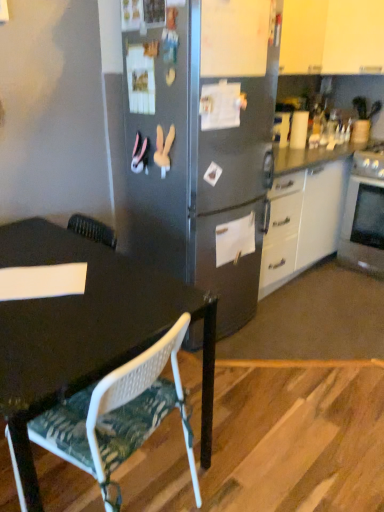
Question: From a real-world perspective, does white mesh chair at lower left sit lower than silver metallic oven at right?

Choices:
 (A) no
 (B) yes

Answer: (A)

Question: Does white mesh chair at lower left have a lesser width compared to silver metallic oven at right?

Choices:
 (A) no
 (B) yes

Answer: (B)

Question: Is white mesh chair at lower left positioned before silver metallic oven at right?

Choices:
 (A) no
 (B) yes

Answer: (B)

Question: Can you confirm if white mesh chair at lower left is smaller than silver metallic oven at right?

Choices:
 (A) yes
 (B) no

Answer: (A)

Question: Can you confirm if white mesh chair at lower left is positioned to the left of silver metallic oven at right?

Choices:
 (A) no
 (B) yes

Answer: (B)

Question: Is white mesh chair at lower left bigger or smaller than white matte cabinet at upper right?

Choices:
 (A) small
 (B) big

Answer: (A)

Question: Is point pos(51,429) positioned closer to the camera than point pos(304,58)?

Choices:
 (A) closer
 (B) farther

Answer: (A)

Question: Considering the positions of white mesh chair at lower left and white matte cabinet at upper right in the image, is white mesh chair at lower left taller or shorter than white matte cabinet at upper right?

Choices:
 (A) short
 (B) tall

Answer: (A)

Question: Is white mesh chair at lower left to the left or to the right of white matte cabinet at upper right in the image?

Choices:
 (A) right
 (B) left

Answer: (B)

Question: Considering the positions of white matte cabinet at upper right and silver metallic oven at right in the image, is white matte cabinet at upper right bigger or smaller than silver metallic oven at right?

Choices:
 (A) small
 (B) big

Answer: (A)

Question: In the image, is white matte cabinet at upper right on the left side or the right side of silver metallic oven at right?

Choices:
 (A) left
 (B) right

Answer: (A)

Question: From a real-world perspective, is white matte cabinet at upper right positioned above or below silver metallic oven at right?

Choices:
 (A) below
 (B) above

Answer: (B)

Question: Looking at their shapes, would you say white matte cabinet at upper right is wider or thinner than silver metallic oven at right?

Choices:
 (A) wide
 (B) thin

Answer: (B)

Question: In the image, is silver metallic oven at right on the left side or the right side of white mesh chair at lower left?

Choices:
 (A) right
 (B) left

Answer: (A)

Question: Is silver metallic oven at right inside or outside of white mesh chair at lower left?

Choices:
 (A) inside
 (B) outside

Answer: (B)